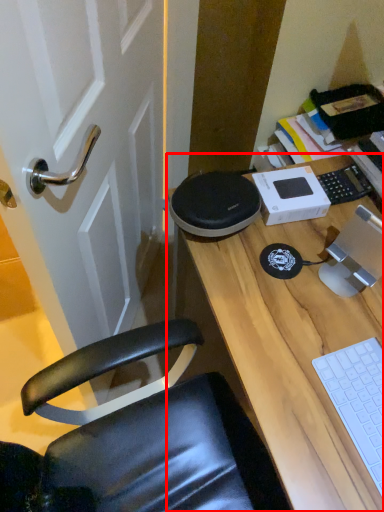
Question: From the image, what is the correct spatial relationship of desk (annotated by the red box) in relation to laptop keyboard?

Choices:
 (A) left
 (B) right

Answer: (B)